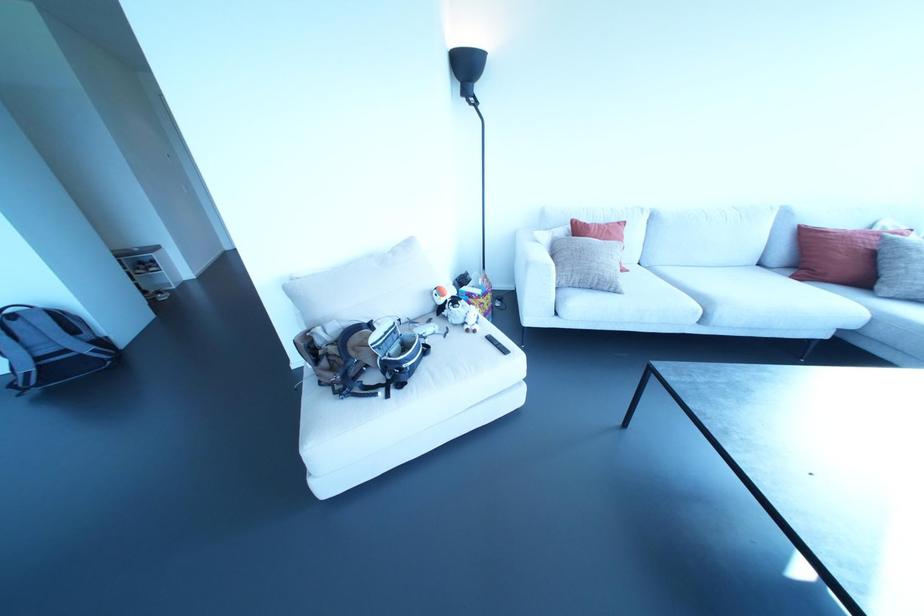
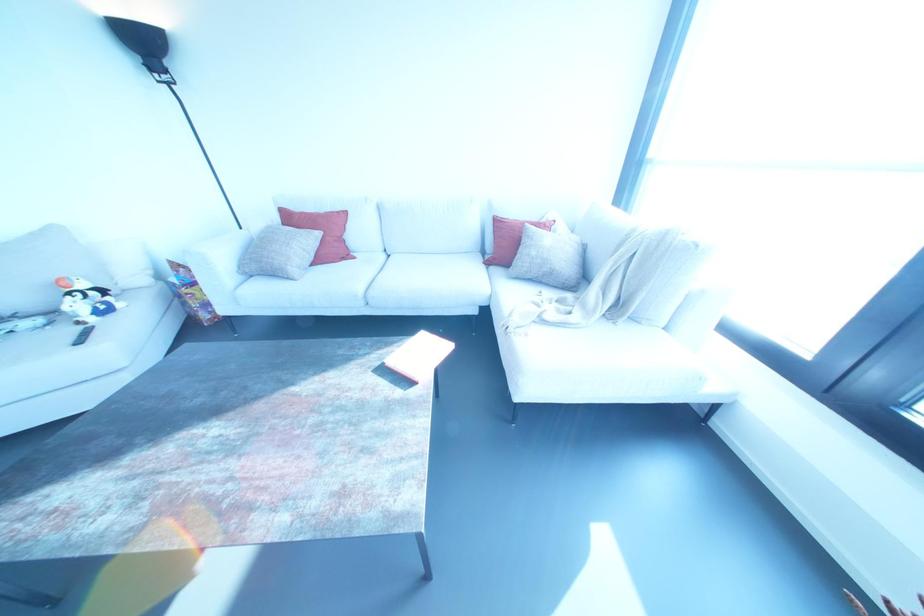
Find the pixel in the second image that matches (466,70) in the first image.

(142, 44)